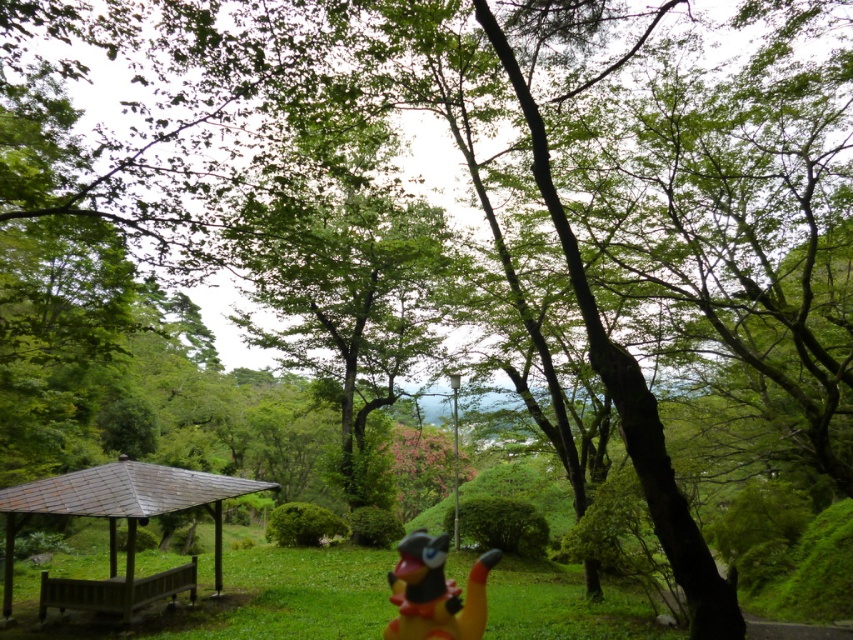
Is brown wooden gazebo at lower left closer to the viewer compared to rubber yellow toy at center?

That is False.

Between point (154, 477) and point (409, 625), which one is positioned behind?

Positioned behind is point (154, 477).

I want to click on brown wooden gazebo at lower left, so tap(126, 525).